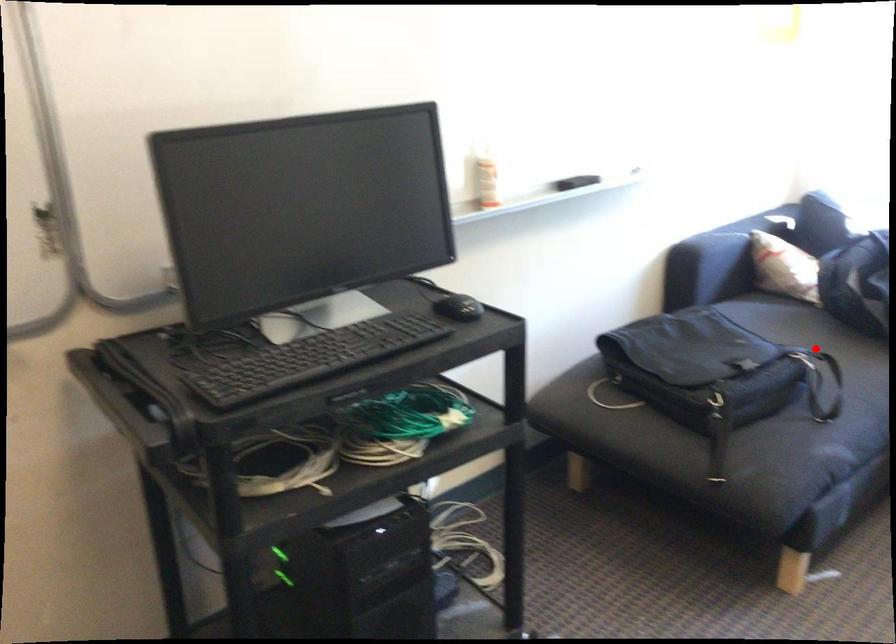
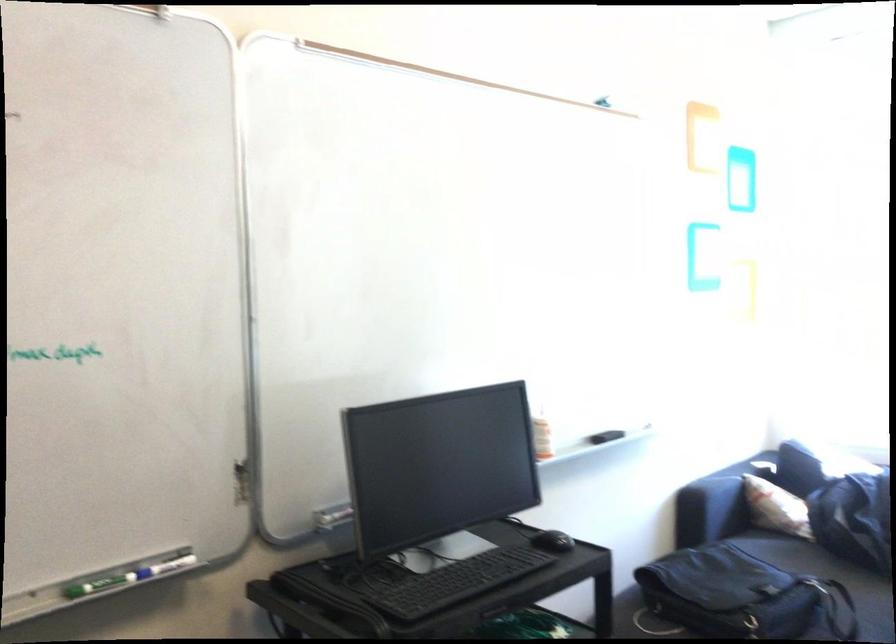
Question: I am providing you with two images of the same scene from different viewpoints. Given a red point in image1, look at the same physical point in image2. Is it:

Choices:
 (A) Closer to the viewpoint
 (B) Farther from the viewpoint

Answer: (B)